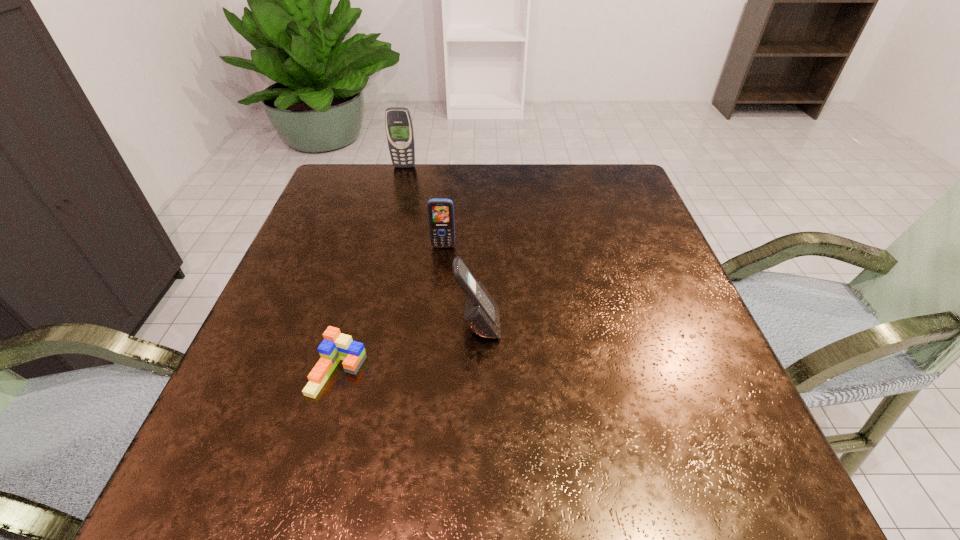
Where is `the farthest object`? This screenshot has height=540, width=960. the farthest object is located at coordinates (399, 129).

Find the location of a particular element. This screenshot has height=540, width=960. the leftmost cellular telephone is located at coordinates (399, 129).

Locate an element on the screen. The height and width of the screenshot is (540, 960). the second nearest object is located at coordinates (481, 314).

Find the location of `the nearest cellular telephone`. the nearest cellular telephone is located at coordinates (481, 314).

Identify the location of the second object from right to left. Image resolution: width=960 pixels, height=540 pixels. (440, 211).

You are a GUI agent. You are given a task and a screenshot of the screen. Output one action in this format:
    pyautogui.click(x=<x>, y=<y>)
    Task: Click on the third nearest object
    
    Given the screenshot: What is the action you would take?
    pyautogui.click(x=440, y=211)

Locate an element on the screen. This screenshot has height=540, width=960. the nearest object is located at coordinates (336, 346).

Locate an element on the screen. The width and height of the screenshot is (960, 540). Lego is located at coordinates (336, 346).

The image size is (960, 540). What are the coordinates of `free location located on the screen of the farthest cellular telephone` in the screenshot? It's located at (397, 192).

The image size is (960, 540). Identify the location of blank area located 0.170m on the front-facing side of the rightmost cellular telephone. tap(589, 325).